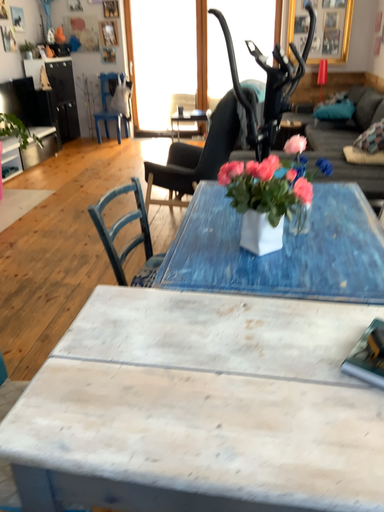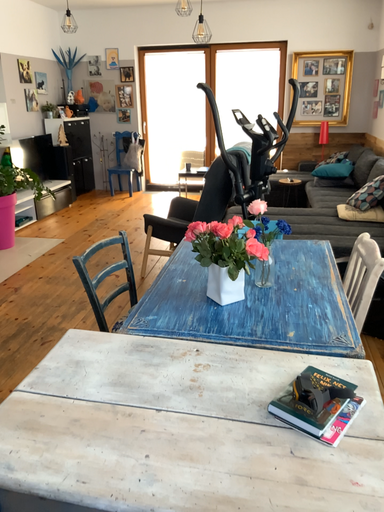
Question: How did the camera likely rotate when shooting the video?

Choices:
 (A) rotated downward
 (B) rotated upward

Answer: (B)